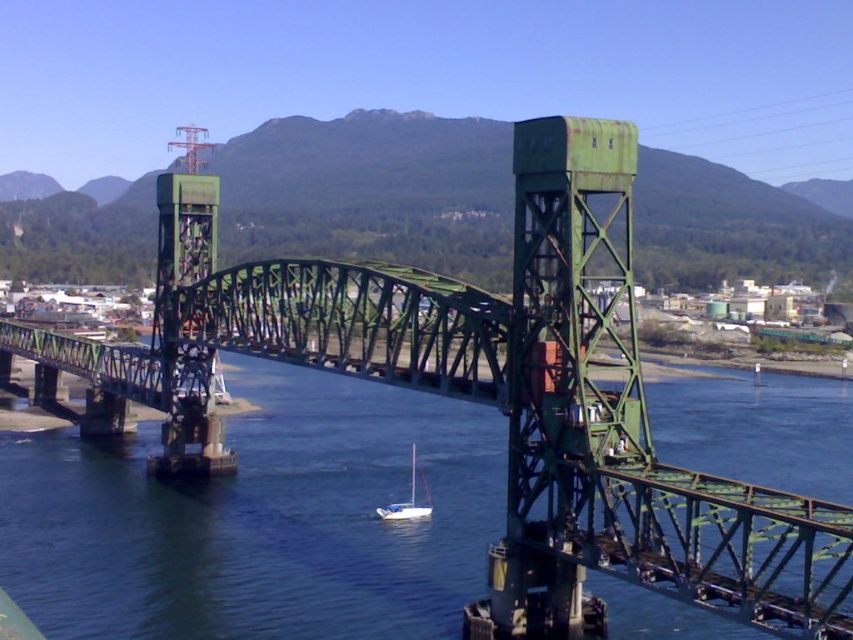
Question: In this image, where is blue water at center located relative to white matte sailboat at center?

Choices:
 (A) right
 (B) left

Answer: (A)

Question: In this image, where is blue water at center located relative to white matte sailboat at center?

Choices:
 (A) below
 (B) above

Answer: (B)

Question: Does blue water at center appear on the left side of white matte sailboat at center?

Choices:
 (A) no
 (B) yes

Answer: (A)